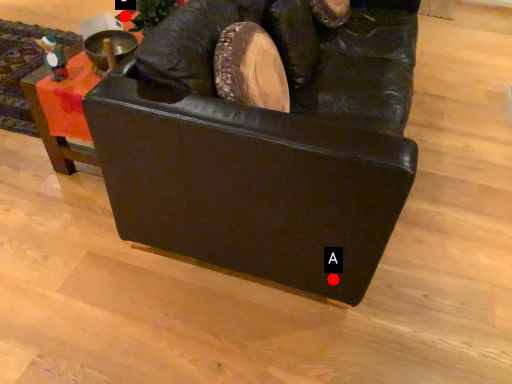
Question: Two points are circled on the image, labeled by A and B beside each circle. Which point is farther from the camera taking this photo?

Choices:
 (A) A is further
 (B) B is further

Answer: (B)